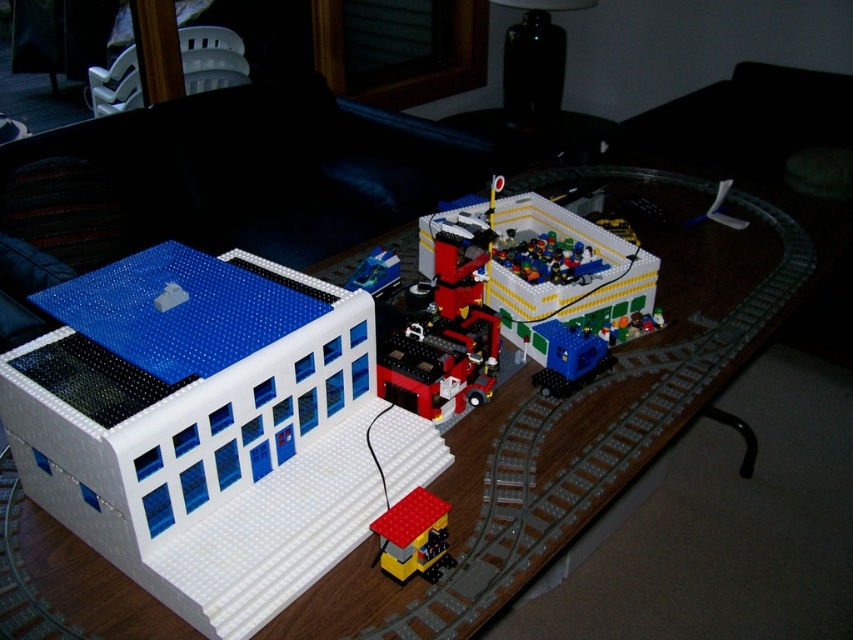
Question: Which of the following is the closest to the observer?

Choices:
 (A) brick red plastic train at lower center
 (B) wooden table at center
 (C) shiny blue plastic car at center
 (D) yellow matte building at center

Answer: (B)

Question: Is wooden table at center smaller than yellow matte building at center?

Choices:
 (A) yes
 (B) no

Answer: (B)

Question: Among these objects, which one is nearest to the camera?

Choices:
 (A) shiny blue plastic car at center
 (B) white matte building at left
 (C) brick red plastic train at lower center

Answer: (B)

Question: Which object is the farthest from the shiny blue plastic car at center?

Choices:
 (A) white matte building at left
 (B) brick red plastic train at lower center

Answer: (B)

Question: Is white matte building at left thinner than shiny blue plastic car at center?

Choices:
 (A) yes
 (B) no

Answer: (B)

Question: Does white matte building at left have a lesser width compared to brick red plastic train at lower center?

Choices:
 (A) no
 (B) yes

Answer: (A)